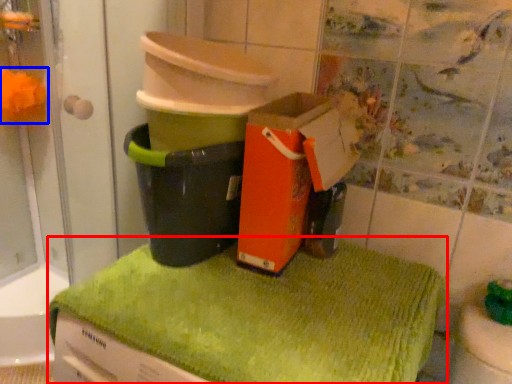
Question: Which object appears farthest to the camera in this image, bath towel (highlighted by a red box) or flower (highlighted by a blue box)?

Choices:
 (A) bath towel
 (B) flower

Answer: (B)